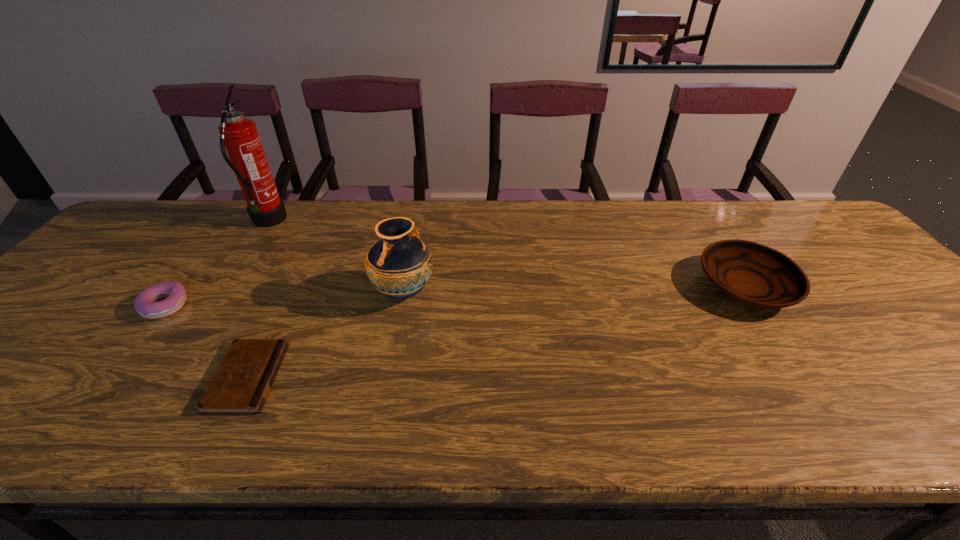
The height and width of the screenshot is (540, 960). What are the coordinates of `the tallest object` in the screenshot? It's located at (239, 135).

I want to click on the fourth object from right to left, so pos(239,135).

Where is `the second tallest object`? the second tallest object is located at coordinates (398, 266).

Where is `the fourth object from left to right`? This screenshot has width=960, height=540. the fourth object from left to right is located at coordinates (398, 266).

Find the location of a particular element. plate is located at coordinates (754, 274).

Find the location of a particular element. the third tallest object is located at coordinates (754, 274).

Locate an element on the screen. The width and height of the screenshot is (960, 540). the second shortest object is located at coordinates (146, 303).

Where is `the leftmost object`? the leftmost object is located at coordinates (146, 303).

The height and width of the screenshot is (540, 960). I want to click on the shortest object, so click(241, 384).

Locate an element on the screen. The image size is (960, 540). the nearest object is located at coordinates (241, 384).